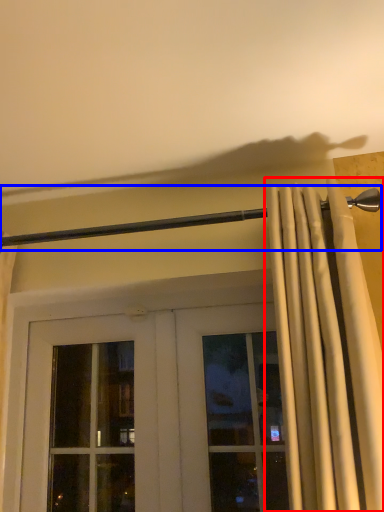
Question: Among these objects, which one is nearest to the camera, curtain (highlighted by a red box) or beam (highlighted by a blue box)?

Choices:
 (A) curtain
 (B) beam

Answer: (A)